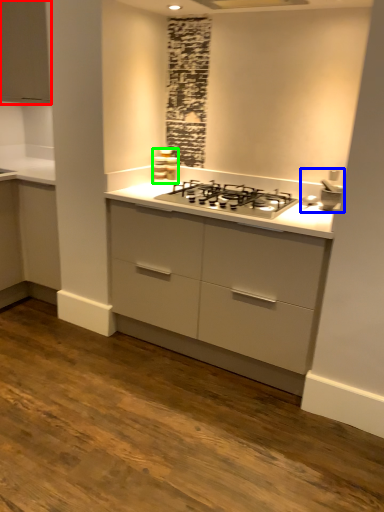
Question: Estimate the real-world distances between objects in this image. Which object is farther from cabinetry (highlighted by a red box), sink (highlighted by a blue box) or appliance (highlighted by a green box)?

Choices:
 (A) sink
 (B) appliance

Answer: (A)